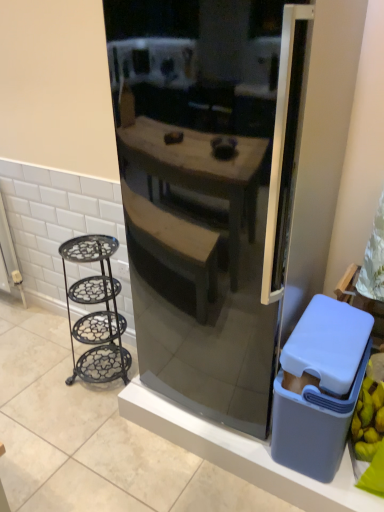
Image resolution: width=384 pixels, height=512 pixels. What do you see at coordinates (204, 205) in the screenshot?
I see `satin black refrigerator at center` at bounding box center [204, 205].

You are a GUI agent. You are given a task and a screenshot of the screen. Output one action in this format:
    pyautogui.click(x=<x>, y=<y>)
    Task: Click on the black wrought iron stand at left
    The image size is (384, 512).
    Given the screenshot: What is the action you would take?
    pyautogui.click(x=96, y=312)

How many degrees apart are the facing directions of gray plastic trash bin at right and gray plastic bin at lower right?

The angle between the facing direction of gray plastic trash bin at right and the facing direction of gray plastic bin at lower right is 0.000673 degrees.

In terms of width, does gray plastic trash bin at right look wider or thinner when compared to gray plastic bin at lower right?

gray plastic trash bin at right is wider than gray plastic bin at lower right.

From a real-world perspective, is gray plastic trash bin at right above or below gray plastic bin at lower right?

gray plastic trash bin at right is above gray plastic bin at lower right.

Is black wrought iron stand at left to the left or to the right of gray plastic trash bin at right in the image?

black wrought iron stand at left is to the left of gray plastic trash bin at right.

Does point (90, 372) come in front of point (318, 317)?

No, it is not.

In the scene shown: From a real-world perspective, is black wrought iron stand at left physically located above or below gray plastic trash bin at right?

In terms of real-world spatial position, black wrought iron stand at left is below gray plastic trash bin at right.

Can we say black wrought iron stand at left lies outside gray plastic trash bin at right?

Yes.

Is satin black refrigerator at center aimed at black wrought iron stand at left?

No, satin black refrigerator at center does not turn towards black wrought iron stand at left.

Does point (203, 295) come farther from viewer compared to point (103, 243)?

No, (203, 295) is closer to viewer.

Is there a large distance between satin black refrigerator at center and black wrought iron stand at left?

No, satin black refrigerator at center is in close proximity to black wrought iron stand at left.

Is satin black refrigerator at center spatially inside black wrought iron stand at left, or outside of it?

satin black refrigerator at center is spatially situated outside black wrought iron stand at left.

Between black wrought iron stand at left and satin black refrigerator at center, which one has smaller size?

black wrought iron stand at left.

Considering the positions of points (112, 343) and (266, 431), is point (112, 343) farther from camera compared to point (266, 431)?

That is True.

Can you see black wrought iron stand at left touching satin black refrigerator at center?

black wrought iron stand at left and satin black refrigerator at center are clearly separated.

Which object is positioned more to the right, gray plastic bin at lower right or satin black refrigerator at center?

gray plastic bin at lower right is more to the right.

Which is farther from the camera, [268,449] or [288,8]?

The point [268,449] is behind.

Consider the image. Is gray plastic bin at lower right spatially inside satin black refrigerator at center, or outside of it?

gray plastic bin at lower right cannot be found inside satin black refrigerator at center.

From a real-world perspective, is satin black refrigerator at center physically above gray plastic bin at lower right?

Correct, in the physical world, satin black refrigerator at center is higher than gray plastic bin at lower right.

Is satin black refrigerator at center positioned with its back to gray plastic bin at lower right?

No, satin black refrigerator at center's orientation is not away from gray plastic bin at lower right.

Is satin black refrigerator at center spatially inside gray plastic bin at lower right, or outside of it?

satin black refrigerator at center cannot be found inside gray plastic bin at lower right.

From the image's perspective, does satin black refrigerator at center appear lower than gray plastic bin at lower right?

Incorrect, from the image's perspective, satin black refrigerator at center is higher than gray plastic bin at lower right.

Does gray plastic bin at lower right have a greater width compared to black wrought iron stand at left?

Incorrect, the width of gray plastic bin at lower right does not surpass that of black wrought iron stand at left.

Locate an element on the screen. furniture that appears on the left of gray plastic bin at lower right is located at coordinates (96, 312).

Would you say gray plastic bin at lower right is inside or outside black wrought iron stand at left?

gray plastic bin at lower right is outside black wrought iron stand at left.

Find the location of a particular element. ledge behind the gray plastic trash bin at right is located at coordinates (242, 454).

Image resolution: width=384 pixels, height=512 pixels. Identify the location of trash bin/can in front of the black wrought iron stand at left. (320, 387).

Considering their positions, is black wrought iron stand at left positioned closer to satin black refrigerator at center than gray plastic bin at lower right?

Among the two, black wrought iron stand at left is located nearer to satin black refrigerator at center.

Based on their spatial positions, is gray plastic bin at lower right or satin black refrigerator at center closer to black wrought iron stand at left?

gray plastic bin at lower right is closer to black wrought iron stand at left.

When comparing their distances from gray plastic trash bin at right, does gray plastic bin at lower right or satin black refrigerator at center seem closer?

The object closer to gray plastic trash bin at right is gray plastic bin at lower right.

Looking at the image, which one is located further to black wrought iron stand at left, gray plastic trash bin at right or gray plastic bin at lower right?

Among the two, gray plastic trash bin at right is located further to black wrought iron stand at left.

Based on their spatial positions, is black wrought iron stand at left or satin black refrigerator at center closer to gray plastic bin at lower right?

black wrought iron stand at left lies closer to gray plastic bin at lower right than the other object.

When comparing their distances from black wrought iron stand at left, does satin black refrigerator at center or gray plastic bin at lower right seem further?

Among the two, satin black refrigerator at center is located further to black wrought iron stand at left.

When comparing their distances from gray plastic trash bin at right, does black wrought iron stand at left or satin black refrigerator at center seem closer?

Among the two, satin black refrigerator at center is located nearer to gray plastic trash bin at right.

Considering their positions, is satin black refrigerator at center positioned further to gray plastic trash bin at right than gray plastic bin at lower right?

satin black refrigerator at center lies further to gray plastic trash bin at right than the other object.

Find the location of a particular element. The width and height of the screenshot is (384, 512). furniture between satin black refrigerator at center and gray plastic bin at lower right from top to bottom is located at coordinates (96, 312).

Where is `ledge between black wrought iron stand at left and gray plastic trash bin at right from left to right`? ledge between black wrought iron stand at left and gray plastic trash bin at right from left to right is located at coordinates (242, 454).

Where is `refrigerator located between black wrought iron stand at left and gray plastic trash bin at right in the left-right direction`? The width and height of the screenshot is (384, 512). refrigerator located between black wrought iron stand at left and gray plastic trash bin at right in the left-right direction is located at coordinates (204, 205).

This screenshot has width=384, height=512. What are the coordinates of `trash bin/can between satin black refrigerator at center and gray plastic bin at lower right vertically` in the screenshot? It's located at (320, 387).